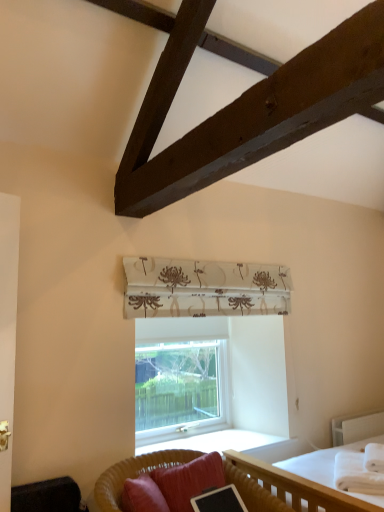
You are a GUI agent. You are given a task and a screenshot of the screen. Output one action in this format:
    pyautogui.click(x=<x>, y=<y>)
    Task: Click on the free spot above white soft blanket at lower right (from a real-world perspective)
    
    Given the screenshot: What is the action you would take?
    pyautogui.click(x=361, y=460)